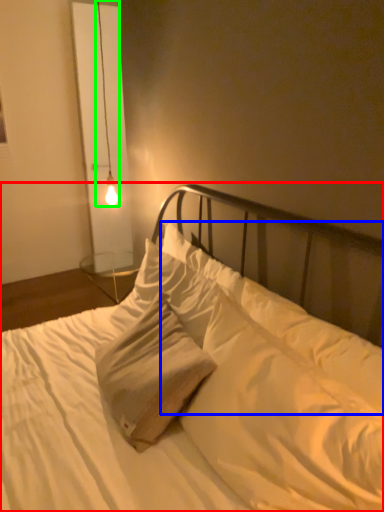
Question: Which object is positioned farthest from bed (highlighted by a red box)? Select from pillow (highlighted by a blue box) and lamp (highlighted by a green box).

Choices:
 (A) pillow
 (B) lamp

Answer: (B)